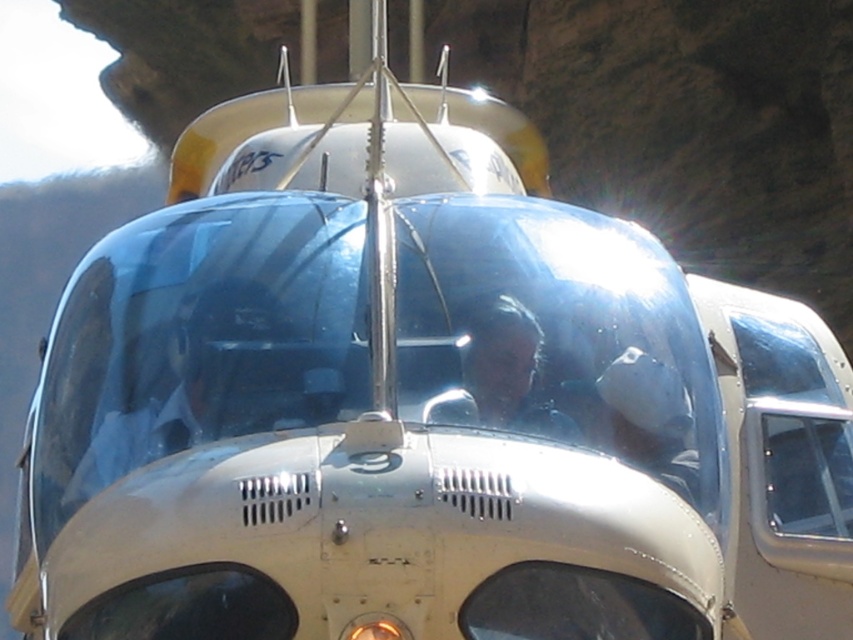
You are a GUI agent. You are given a task and a screenshot of the screen. Output one action in this format:
    pyautogui.click(x=<x>, y=<y>)
    Task: Click on the transparent plastic pilot at center
    
    Given the screenshot: What is the action you would take?
    pyautogui.click(x=144, y=380)

This screenshot has height=640, width=853. What do you see at coordinates (144, 380) in the screenshot? I see `transparent plastic pilot at center` at bounding box center [144, 380].

Locate an element on the screen. transparent plastic pilot at center is located at coordinates (144, 380).